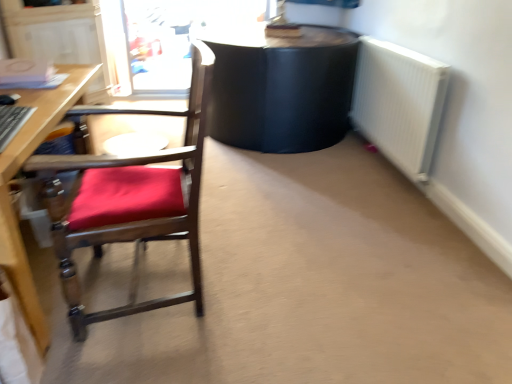
Locate an element on the screen. vacant area that is in front of white metallic radiator at right is located at coordinates (368, 206).